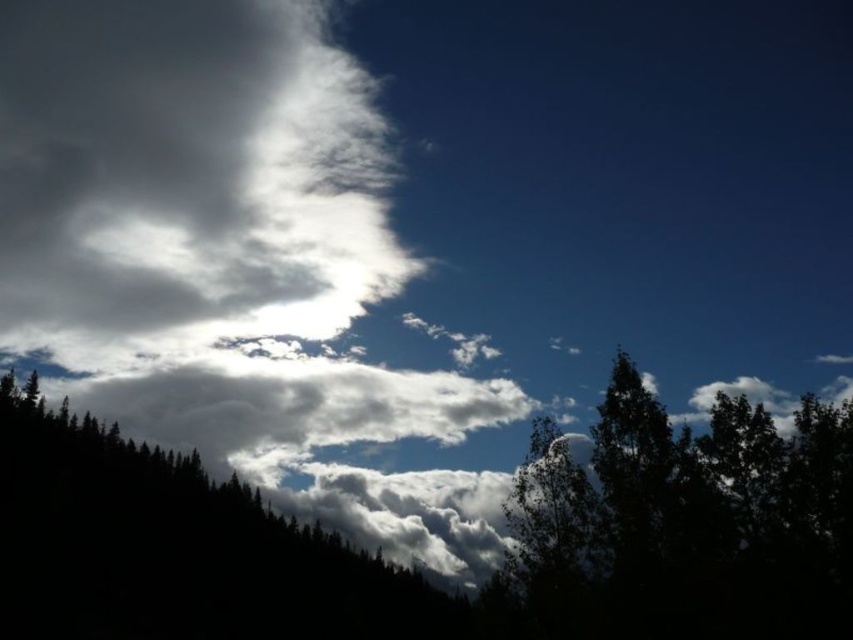
Question: Does dark green foliage at lower center appear on the right side of green leafy tree at center?

Choices:
 (A) yes
 (B) no

Answer: (B)

Question: Can you confirm if dark green foliage at lower center is positioned below white fluffy cloud at upper left?

Choices:
 (A) yes
 (B) no

Answer: (A)

Question: Which point is closer to the camera taking this photo?

Choices:
 (A) (683, 634)
 (B) (137, 216)

Answer: (A)

Question: Which point is farther from the camera taking this photo?

Choices:
 (A) (753, 524)
 (B) (821, 483)
 (C) (7, 275)

Answer: (C)

Question: Among these points, which one is nearest to the camera?

Choices:
 (A) (546, 486)
 (B) (65, 256)

Answer: (A)

Question: Is white fluffy cloud at upper left below green leafy tree at center?

Choices:
 (A) no
 (B) yes

Answer: (A)